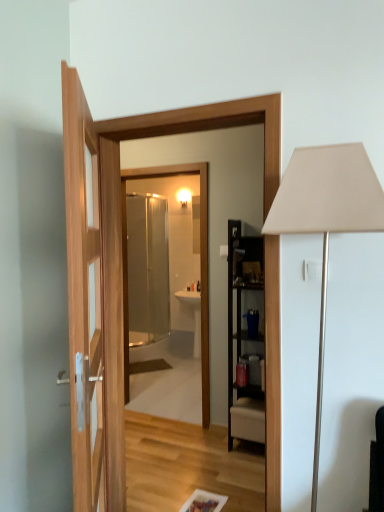
Measure the distance between transparent glass mirror at center and camera.

They are 3.28 meters apart.

Find the location of `clear glass shower door at center`. clear glass shower door at center is located at coordinates (147, 268).

Which point is more forward, (122, 183) or (160, 333)?

The point (122, 183) is closer to the camera.

Measure the distance from transparent glass mirror at center to clear glass shower door at center.

transparent glass mirror at center is 7.89 feet from clear glass shower door at center.

From the image's perspective, which object appears higher, transparent glass mirror at center or clear glass shower door at center?

clear glass shower door at center appears higher in the image.

Is transparent glass mirror at center at the right side of clear glass shower door at center?

Yes, transparent glass mirror at center is to the right of clear glass shower door at center.

Is clear glass shower door at center positioned beyond the bounds of transparent glass mirror at center?

Yes, clear glass shower door at center is not within transparent glass mirror at center.

Is clear glass shower door at center wider or thinner than transparent glass mirror at center?

clear glass shower door at center is wider than transparent glass mirror at center.

Does point (160, 293) lie in front of point (203, 314)?

No.

Who is smaller, clear glass shower door at center or transparent glass mirror at center?

transparent glass mirror at center.

In the scene shown: Are transparent glass mirror at center and white matte table lamp at right making contact?

No, transparent glass mirror at center is not making contact with white matte table lamp at right.

Considering the relative sizes of transparent glass mirror at center and white matte table lamp at right in the image provided, is transparent glass mirror at center shorter than white matte table lamp at right?

Incorrect, the height of transparent glass mirror at center does not fall short of that of white matte table lamp at right.

Is transparent glass mirror at center thinner than white matte table lamp at right?

Yes, transparent glass mirror at center is thinner than white matte table lamp at right.

From the image's perspective, which object appears higher, transparent glass mirror at center or white matte table lamp at right?

From the image's view, transparent glass mirror at center is above.

Is point (304, 148) closer or farther from the camera than point (206, 227)?

Point (304, 148) is closer to the camera than point (206, 227).

Measure the distance between white matte table lamp at right and transparent glass mirror at center.

7.20 feet.

Looking at their sizes, would you say white matte table lamp at right is wider or thinner than transparent glass mirror at center?

white matte table lamp at right is wider than transparent glass mirror at center.

From a real-world perspective, which is physically below, white matte table lamp at right or transparent glass mirror at center?

transparent glass mirror at center, from a real-world perspective.

Is there a large distance between white matte table lamp at right and clear glass shower door at center?

Indeed, white matte table lamp at right is not near clear glass shower door at center.

From the image's perspective, is white matte table lamp at right above or below clear glass shower door at center?

From the image's perspective, white matte table lamp at right appears below clear glass shower door at center.

I want to click on table lamp in front of the clear glass shower door at center, so click(326, 220).

Is point (314, 473) in front of point (148, 220)?

Yes.

Is clear glass shower door at center facing away from white matte table lamp at right?

That's not correct — clear glass shower door at center is not looking away from white matte table lamp at right.

Consider the image. Between clear glass shower door at center and white matte table lamp at right, which one appears on the left side from the viewer's perspective?

Positioned to the left is clear glass shower door at center.

From the image's perspective, is clear glass shower door at center under white matte table lamp at right?

Incorrect, from the image's perspective, clear glass shower door at center is higher than white matte table lamp at right.

Where is `screen door on the left of white matte table lamp at right`? screen door on the left of white matte table lamp at right is located at coordinates (147, 268).

Identify the location of mirror that is under the clear glass shower door at center (from a real-world perspective). The image size is (384, 512). (201, 263).

The width and height of the screenshot is (384, 512). Find the location of `screen door that appears above the transparent glass mirror at center (from the image's perspective)`. screen door that appears above the transparent glass mirror at center (from the image's perspective) is located at coordinates (147, 268).

From the image, which object appears to be nearer to clear glass shower door at center, transparent glass mirror at center or white matte table lamp at right?

Based on the image, transparent glass mirror at center appears to be nearer to clear glass shower door at center.

Looking at the image, which one is located closer to transparent glass mirror at center, clear glass shower door at center or white matte table lamp at right?

white matte table lamp at right is closer to transparent glass mirror at center.

Which object lies further to the anchor point white matte table lamp at right, clear glass shower door at center or transparent glass mirror at center?

clear glass shower door at center.

Considering their positions, is transparent glass mirror at center positioned further to white matte table lamp at right than clear glass shower door at center?

clear glass shower door at center.

Estimate the real-world distances between objects in this image. Which object is closer to clear glass shower door at center, white matte table lamp at right or transparent glass mirror at center?

transparent glass mirror at center is closer to clear glass shower door at center.

From the image, which object appears to be nearer to transparent glass mirror at center, white matte table lamp at right or clear glass shower door at center?

white matte table lamp at right is closer to transparent glass mirror at center.

Find the location of a particular element. Image resolution: width=384 pixels, height=512 pixels. mirror located between white matte table lamp at right and clear glass shower door at center in the depth direction is located at coordinates (201, 263).